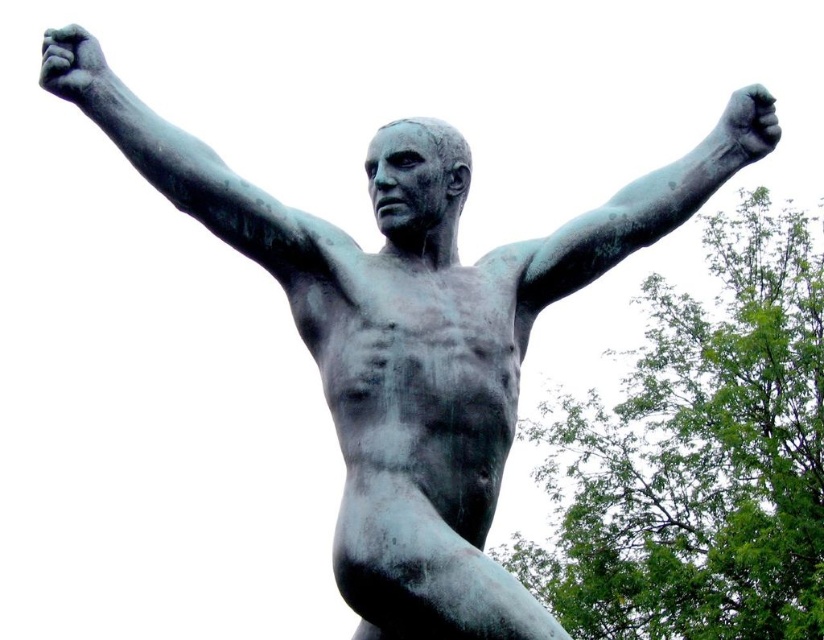
Does bronze/smooth arm at upper left have a larger size compared to bronze/rough arm at upper right?

No, bronze/smooth arm at upper left is not bigger than bronze/rough arm at upper right.

You are a GUI agent. You are given a task and a screenshot of the screen. Output one action in this format:
    pyautogui.click(x=<x>, y=<y>)
    Task: Click on the bronze/smooth arm at upper left
    Image resolution: width=824 pixels, height=640 pixels.
    Given the screenshot: What is the action you would take?
    click(190, 168)